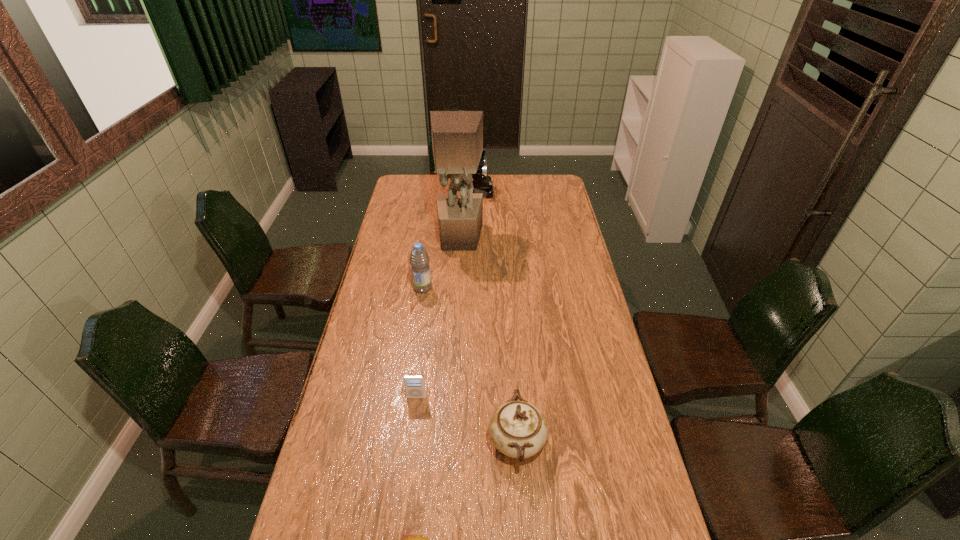
Where is `free spot between the second nearest object and the fifth shortest object`? The image size is (960, 540). free spot between the second nearest object and the fifth shortest object is located at coordinates (494, 316).

Image resolution: width=960 pixels, height=540 pixels. Identify the location of vacant point located between the iPod and the farthest object. (444, 294).

Identify the location of free space between the tallest object and the second nearest object. The image size is (960, 540). (488, 340).

You are a GUI agent. You are given a task and a screenshot of the screen. Output one action in this format:
    pyautogui.click(x=<x>, y=<y>)
    Task: Click on the vacant space in between the sculpture and the second nearest object
    The image size is (960, 540).
    Given the screenshot: What is the action you would take?
    pyautogui.click(x=488, y=340)

The height and width of the screenshot is (540, 960). Identify the location of free space between the camcorder and the iPod. (444, 294).

Identify the location of free area in between the water bottle and the third shortest object. The height and width of the screenshot is (540, 960). (469, 364).

Find the location of a particular element. object that is the fifth nearest to the iPod is located at coordinates (482, 183).

This screenshot has width=960, height=540. I want to click on object that is the fifth closest one to the fourth shortest object, so click(408, 539).

The width and height of the screenshot is (960, 540). I want to click on vacant area in the image that satisfies the following two spatial constraints: 1. on the lens mount of the third shortest object; 2. on the left side of the camcorder, so click(466, 442).

You are a GUI agent. You are given a task and a screenshot of the screen. Output one action in this format:
    pyautogui.click(x=<x>, y=<y>)
    Task: Click on the free region that satisfies the following two spatial constraints: 1. on the lens mount of the second tallest object; 2. on the right side of the chinaware
    
    Given the screenshot: What is the action you would take?
    pyautogui.click(x=466, y=442)